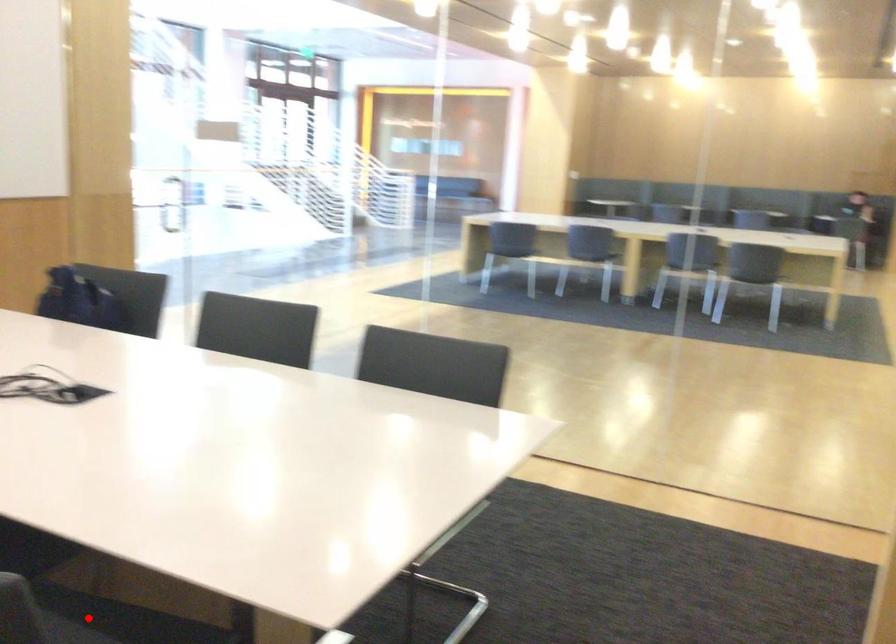
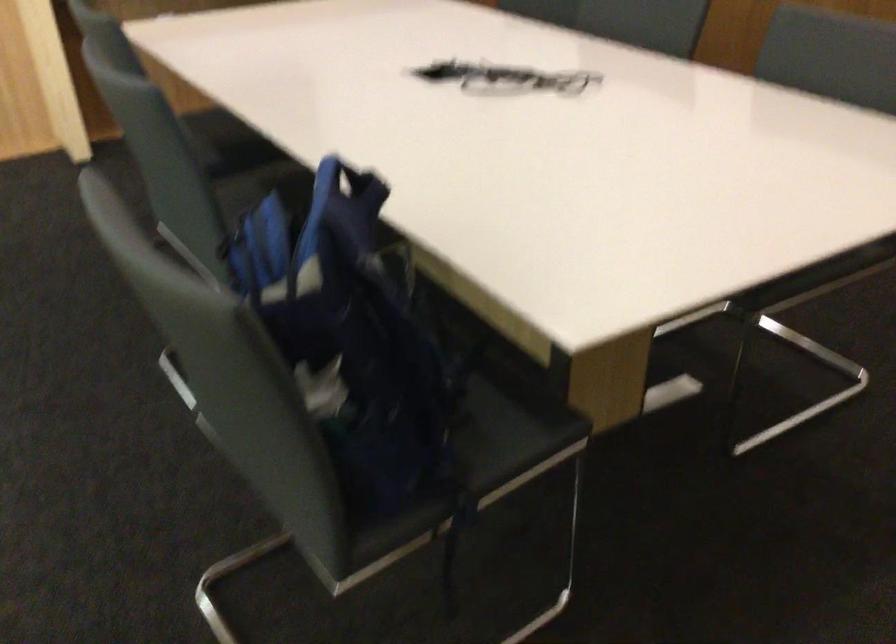
Question: I am providing you with two images of the same scene from different viewpoints. A red point is marked on the first image. Is the red point's position out of view in image 2?

Choices:
 (A) Yes
 (B) No

Answer: (A)